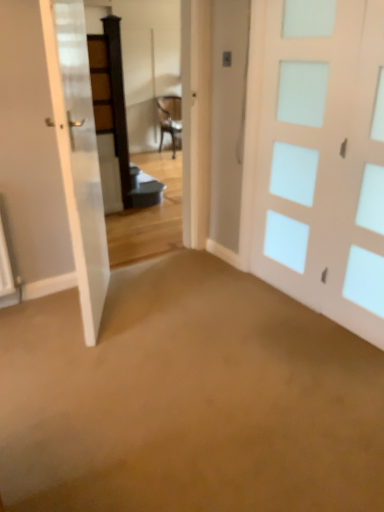
Question: Considering the relative sizes of white glossy door at left, arranged as the second door when viewed from the right, and white frosted glass door at right, the second door from the left, in the image provided, is white glossy door at left, arranged as the second door when viewed from the right, thinner than white frosted glass door at right, the second door from the left,?

Choices:
 (A) yes
 (B) no

Answer: (B)

Question: From the image's perspective, is white glossy door at left, arranged as the second door when viewed from the right, beneath white frosted glass door at right, the 1th door from the right?

Choices:
 (A) no
 (B) yes

Answer: (B)

Question: Does white glossy door at left, which is the 1th door in left-to-right order, lie in front of white frosted glass door at right, the 1th door from the right?

Choices:
 (A) no
 (B) yes

Answer: (B)

Question: Does white glossy door at left, which is the 1th door in left-to-right order, have a greater height compared to white frosted glass door at right, the 1th door from the right?

Choices:
 (A) yes
 (B) no

Answer: (B)

Question: From a real-world perspective, is white glossy door at left, arranged as the second door when viewed from the right, located higher than white frosted glass door at right, the 1th door from the right?

Choices:
 (A) no
 (B) yes

Answer: (A)

Question: Is white glossy door at left, arranged as the second door when viewed from the right, bigger than white frosted glass door at right, the second door from the left?

Choices:
 (A) yes
 (B) no

Answer: (A)

Question: Is white frosted glass door at right, the 1th door from the right, smaller than white glossy door at left, which is the 1th door in left-to-right order?

Choices:
 (A) yes
 (B) no

Answer: (A)

Question: From the image's perspective, is white frosted glass door at right, the second door from the left, above white glossy door at left, which is the 1th door in left-to-right order?

Choices:
 (A) yes
 (B) no

Answer: (A)

Question: Is white frosted glass door at right, the second door from the left, to the right of white glossy door at left, which is the 1th door in left-to-right order, from the viewer's perspective?

Choices:
 (A) no
 (B) yes

Answer: (B)

Question: Is white frosted glass door at right, the 1th door from the right, next to white glossy door at left, arranged as the second door when viewed from the right?

Choices:
 (A) no
 (B) yes

Answer: (A)

Question: Is white frosted glass door at right, the second door from the left, oriented towards white glossy door at left, arranged as the second door when viewed from the right?

Choices:
 (A) yes
 (B) no

Answer: (A)

Question: Is white frosted glass door at right, the second door from the left, completely or partially outside of white glossy door at left, arranged as the second door when viewed from the right?

Choices:
 (A) yes
 (B) no

Answer: (A)

Question: Considering the positions of white frosted glass door at right, the 1th door from the right, and white glossy door at left, arranged as the second door when viewed from the right, in the image, is white frosted glass door at right, the 1th door from the right, wider or thinner than white glossy door at left, arranged as the second door when viewed from the right,?

Choices:
 (A) thin
 (B) wide

Answer: (A)